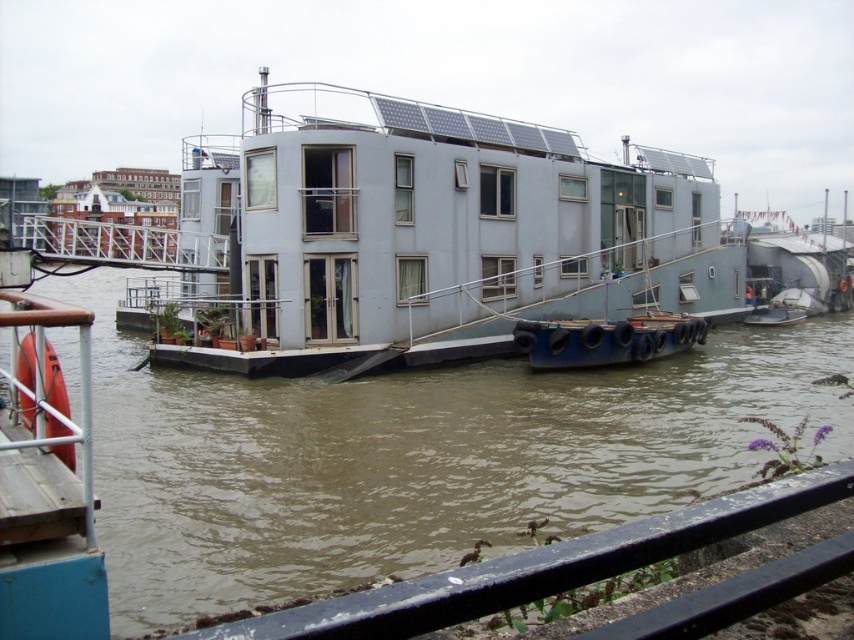
Question: Is brown murky water at center wider than light gray concrete houseboat at center?

Choices:
 (A) no
 (B) yes

Answer: (A)

Question: Can you confirm if brown murky water at center is positioned above light gray concrete houseboat at center?

Choices:
 (A) no
 (B) yes

Answer: (A)

Question: From the image, what is the correct spatial relationship of brown murky water at center in relation to light gray concrete houseboat at center?

Choices:
 (A) below
 (B) above

Answer: (A)

Question: Which point is closer to the camera taking this photo?

Choices:
 (A) (221, 536)
 (B) (712, 221)

Answer: (A)